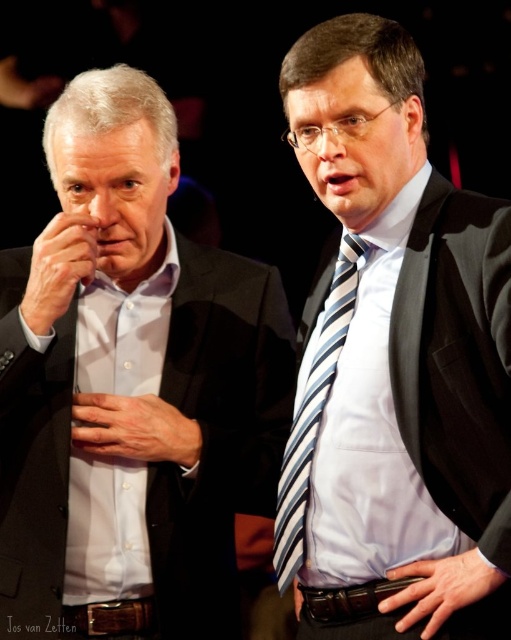
Describe the element at coordinates (130, 392) in the screenshot. I see `matte black suit at left` at that location.

Who is positioned more to the right, matte black suit at left or matte glass nose at center?

matte glass nose at center is more to the right.

Locate an element on the screen. matte black suit at left is located at coordinates (130, 392).

This screenshot has height=640, width=511. In order to click on matte black suit at left in this screenshot , I will do `click(130, 392)`.

Which is above, smooth skin hand at left or matte skin nose at center?

matte skin nose at center is higher up.

Is smooth skin hand at left above matte skin nose at center?

No.

Image resolution: width=511 pixels, height=640 pixels. What do you see at coordinates (58, 268) in the screenshot?
I see `smooth skin hand at left` at bounding box center [58, 268].

I want to click on smooth skin hand at left, so click(x=58, y=268).

Measure the distance from matte black suit at left to blue striped tie at center.

They are 13.51 inches apart.

Does matte black suit at left lie in front of blue striped tie at center?

No, it is not.

The width and height of the screenshot is (511, 640). What are the coordinates of `matte black suit at left` in the screenshot? It's located at (130, 392).